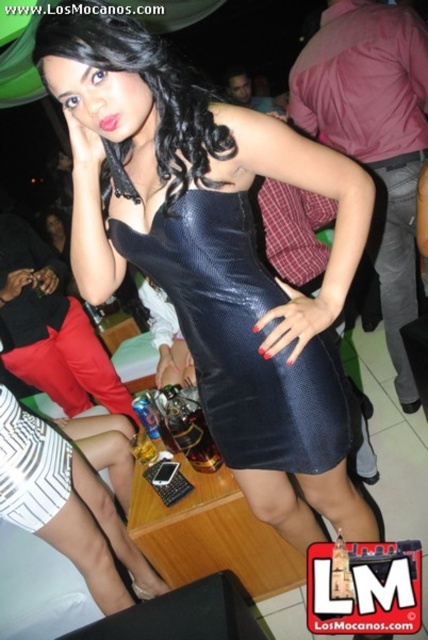
Question: Which object appears closest to the camera in this image?

Choices:
 (A) black leather dress at center
 (B) black leather pants at right

Answer: (A)

Question: Is black leather dress at center wider than black leather pants at right?

Choices:
 (A) yes
 (B) no

Answer: (A)

Question: Can you confirm if black leather dress at center is positioned above black leather pants at right?

Choices:
 (A) yes
 (B) no

Answer: (B)

Question: Is black leather dress at center to the left of black leather pants at right from the viewer's perspective?

Choices:
 (A) yes
 (B) no

Answer: (A)